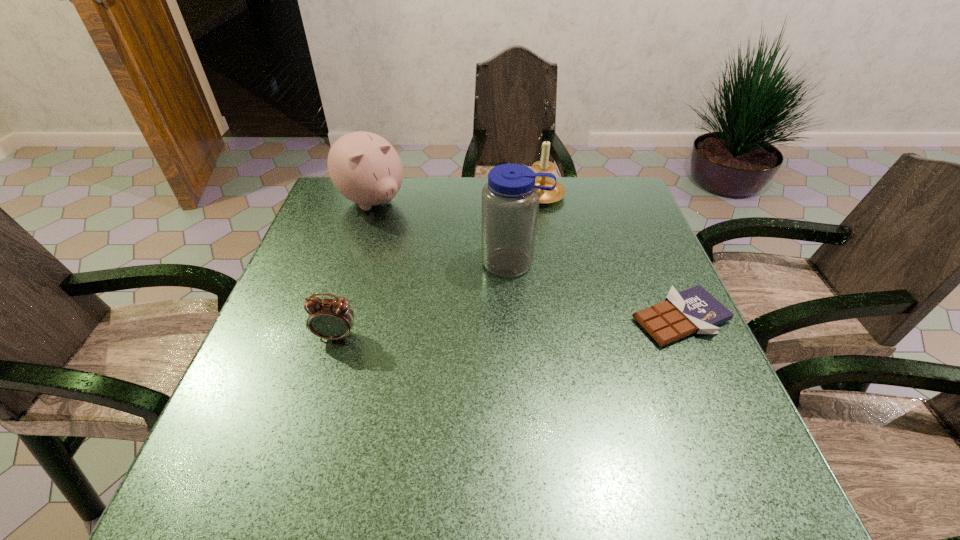
The image size is (960, 540). What are the coordinates of `alarm clock positioned at the left edge` in the screenshot? It's located at (332, 319).

Where is `piggy bank at the left edge`? piggy bank at the left edge is located at coordinates (365, 168).

Find the location of `object that is at the right edge`. object that is at the right edge is located at coordinates (694, 310).

I want to click on object that is at the far left corner, so click(365, 168).

The image size is (960, 540). Find the location of `vacant space at the far edge of the desktop`. vacant space at the far edge of the desktop is located at coordinates (551, 212).

At what (x,y) coordinates should I click in order to perform the action: click on vacant space at the left edge of the desktop. Please return your answer as a coordinate pair (x, y). Looking at the image, I should click on (311, 362).

At what (x,y) coordinates should I click in order to perform the action: click on vacant area at the right edge. Please return your answer as a coordinate pair (x, y). This screenshot has height=540, width=960. Looking at the image, I should click on (657, 261).

I want to click on vacant space at the near left corner, so click(x=305, y=420).

Where is `vacant space at the far right corner of the desktop`? vacant space at the far right corner of the desktop is located at coordinates (583, 201).

The image size is (960, 540). In the image, there is a desktop. Find the location of `vacant region at the near right corner`. vacant region at the near right corner is located at coordinates (659, 441).